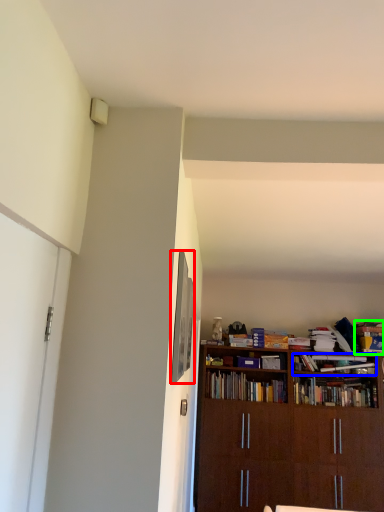
Question: Based on their relative distances, which object is farther from picture frame (highlighted by a red box)? Choose from book (highlighted by a blue box) and book (highlighted by a green box).

Choices:
 (A) book
 (B) book

Answer: (B)